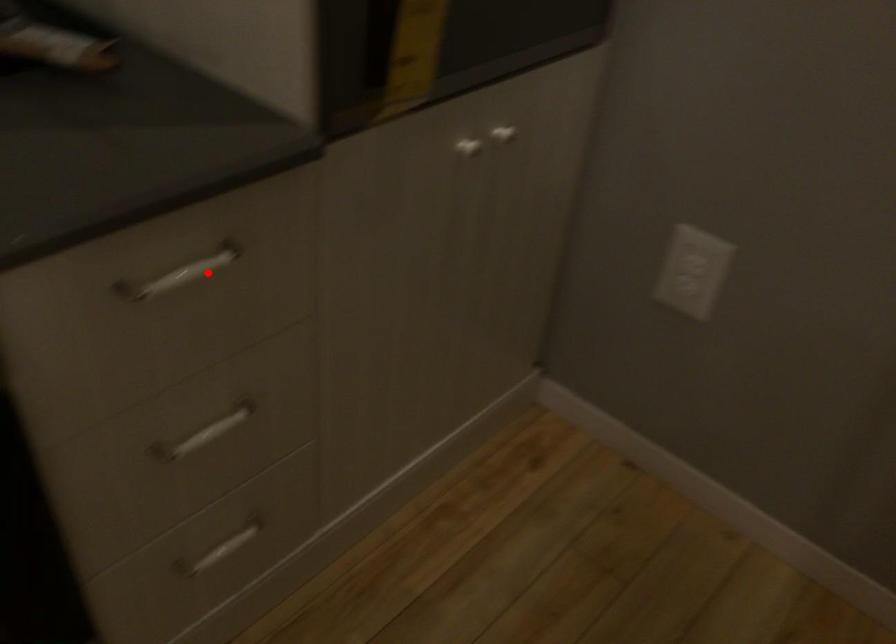
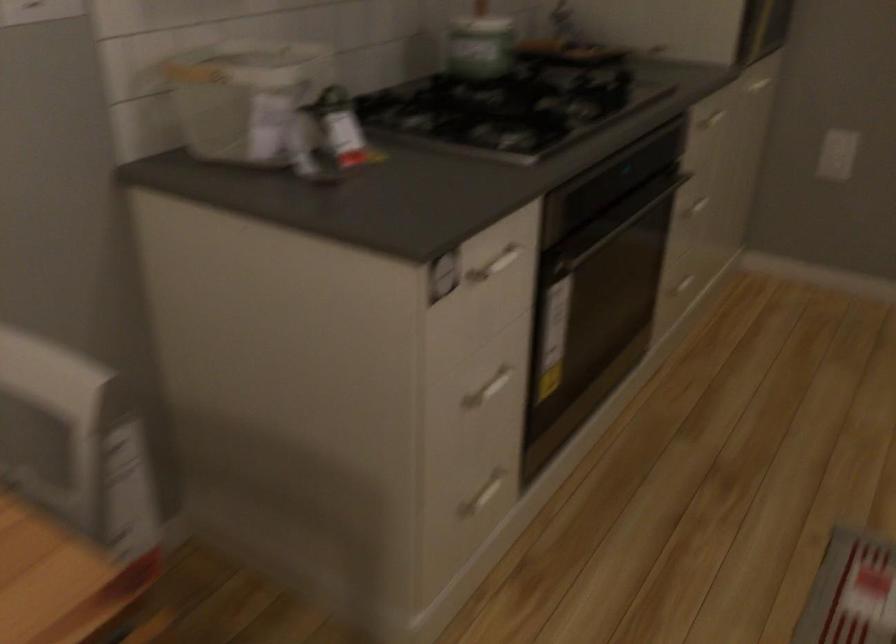
Locate, in the second image, the point that corresponds to the highlighted location in the first image.

(713, 118)